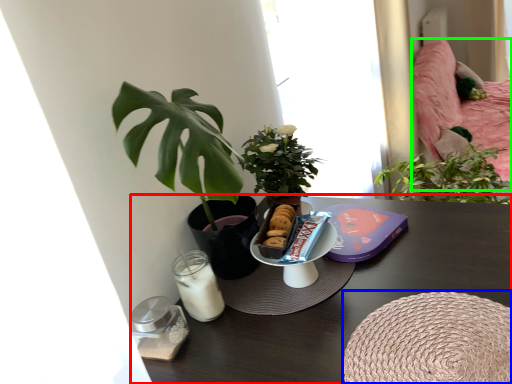
Question: Which object is positioned closest to table (highlighted by a red box)? Select from round table (highlighted by a blue box) and bed (highlighted by a green box).

Choices:
 (A) round table
 (B) bed

Answer: (A)